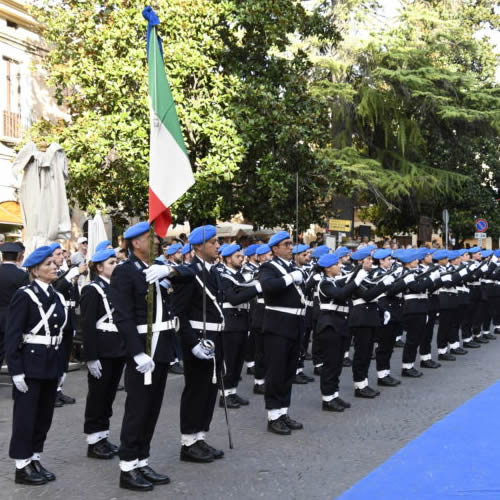
This screenshot has height=500, width=500. What are the coordinates of `blue mat` in the screenshot? It's located at (439, 472), (475, 426), (442, 483).